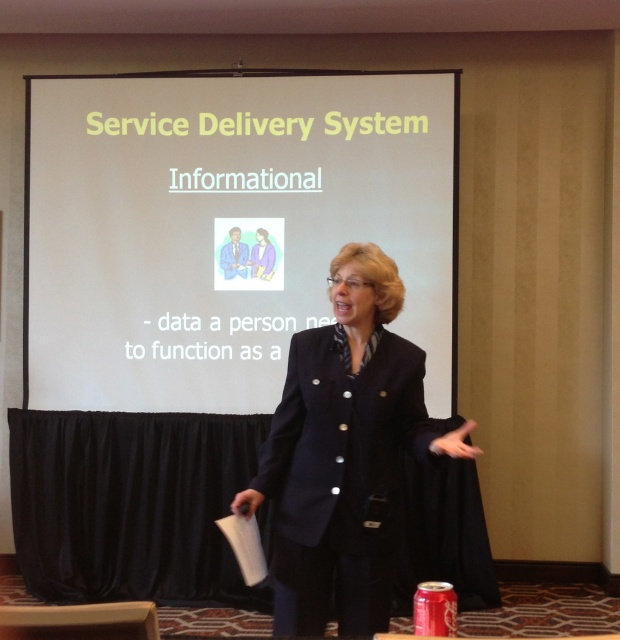
Does white paper at center appear under navy blue blazer at center?

No, white paper at center is not below navy blue blazer at center.

Between point (272, 316) and point (329, 269), which one is positioned behind?

The point (272, 316) is behind.

In order to click on white paper at center in this screenshot , I will do `click(224, 228)`.